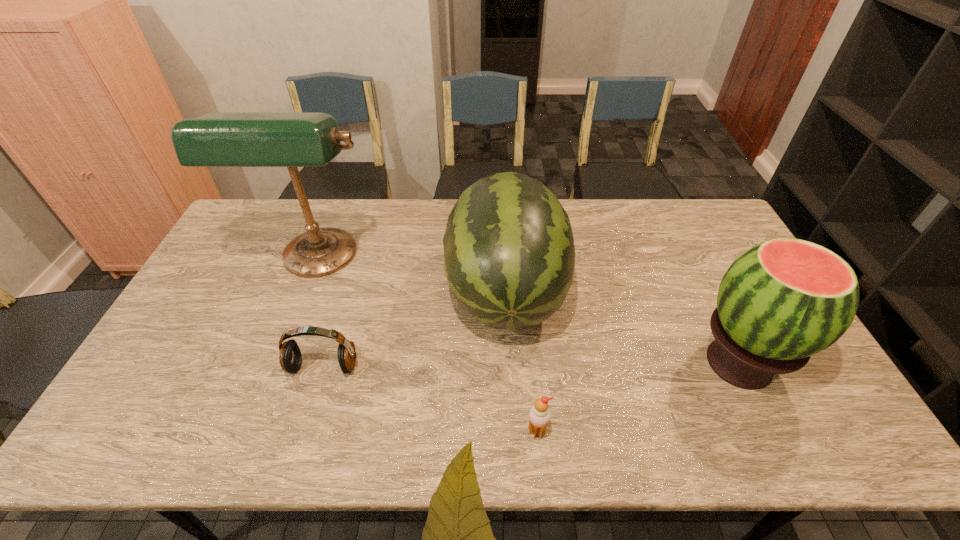
Image resolution: width=960 pixels, height=540 pixels. I want to click on vacant space that satisfies the following two spatial constraints: 1. above the green lampshade of the right watermelon; 2. on the right side of the table lamp, so click(x=278, y=363).

Locate an element on the screen. vacant region that satisfies the following two spatial constraints: 1. above the green lampshade of the tallest object; 2. on the right side of the left watermelon is located at coordinates (305, 292).